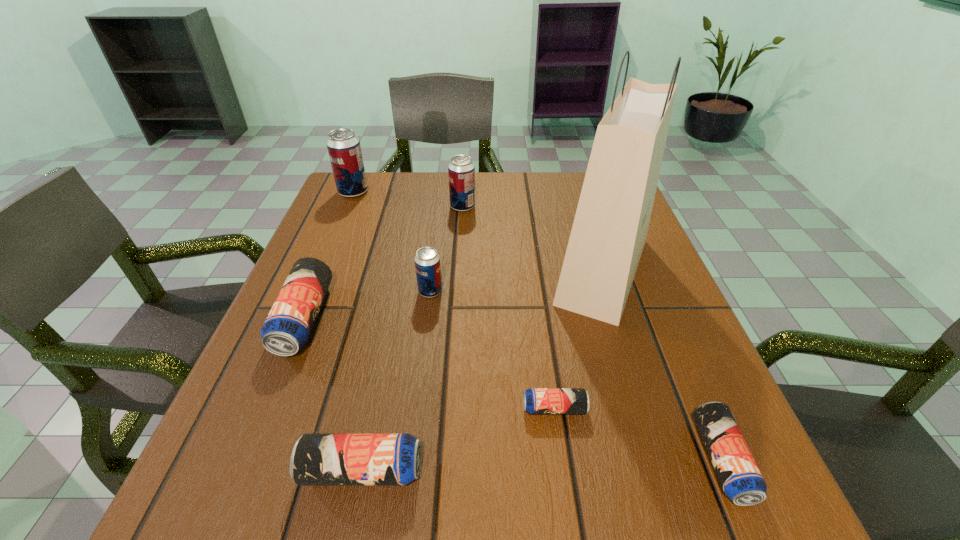
Choose which blue beer can is the fourth nearest neighbor to the second nearest red beer can. Please provide its 2D coordinates. Your answer should be formatted as a tuple, i.e. [(x, y)], where the tuple contains the x and y coordinates of a point satisfying the conditions above.

[(741, 480)]

Locate an element on the screen. blue beer can that is the second closest one to the shopping bag is located at coordinates (741, 480).

What are the coordinates of `vacant space that satisfies the following two spatial constraints: 1. on the front side of the second nearest red beer can; 2. on the right side of the tallest object` in the screenshot? It's located at (459, 271).

Where is `free space that satisfies the following two spatial constraints: 1. on the front side of the sixth nearest beer can; 2. on the right side of the seventh shortest object`? This screenshot has width=960, height=540. free space that satisfies the following two spatial constraints: 1. on the front side of the sixth nearest beer can; 2. on the right side of the seventh shortest object is located at coordinates (348, 207).

Find the location of a particular element. The image size is (960, 540). free space that satisfies the following two spatial constraints: 1. on the front side of the seventh shortest object; 2. on the right side of the nearest red beer can is located at coordinates (311, 291).